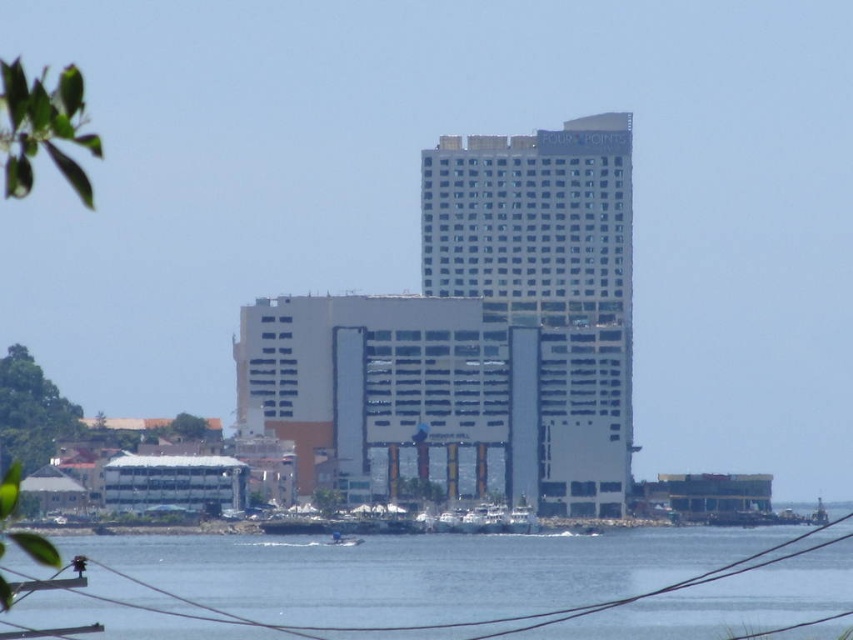
Based on the scene description, what are the coordinates of the white glass building at center?

The white glass building at center is located at coordinates point (546, 294).

You are standing on the dock and see the transparent water at lower center and the blue plastic boat at lower center. Which object is closer to your right side?

The transparent water at lower center is positioned on the right side of the blue plastic boat at lower center, so the transparent water at lower center is closer to your right side.